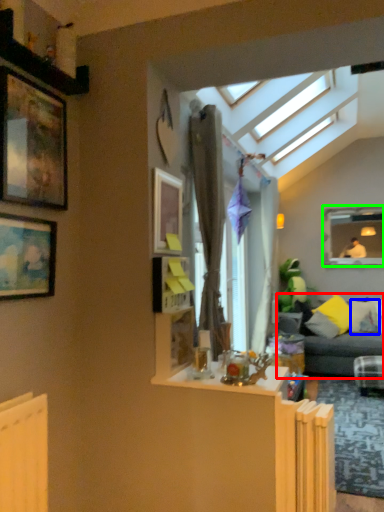
Question: Estimate the real-world distances between objects in this image. Which object is closer to studio couch (highlighted by a red box), pillow (highlighted by a blue box) or window frame (highlighted by a green box)?

Choices:
 (A) pillow
 (B) window frame

Answer: (A)